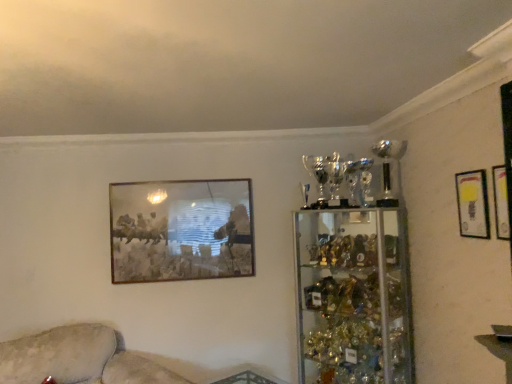
Question: Considering the relative positions of matte gold picture frame at upper right, which is the first picture frame from front to back, and clear glass trophy case at right in the image provided, is matte gold picture frame at upper right, which is the first picture frame from front to back, to the left or to the right of clear glass trophy case at right?

Choices:
 (A) left
 (B) right

Answer: (B)

Question: From their relative heights in the image, would you say matte gold picture frame at upper right, which is the first picture frame from front to back, is taller or shorter than clear glass trophy case at right?

Choices:
 (A) short
 (B) tall

Answer: (A)

Question: Estimate the real-world distances between objects in this image. Which object is closer to the matte gold picture frame at upper right, which appears as the second picture frame when viewed from the back?

Choices:
 (A) matte gold picture frame at upper right, placed as the 3th picture frame when sorted from back to front
 (B) clear glass trophy case at right
 (C) beige fabric couch at lower left
 (D) metallic gold picture frame at upper center, the 3th picture frame from the right

Answer: (A)

Question: Estimate the real-world distances between objects in this image. Which object is closer to the metallic gold picture frame at upper center, which is the 1th picture frame in back-to-front order?

Choices:
 (A) clear glass trophy case at right
 (B) beige fabric couch at lower left
 (C) matte gold picture frame at upper right, placed as the 3th picture frame when sorted from back to front
 (D) matte gold picture frame at upper right, marked as the 2th picture frame in a left-to-right arrangement

Answer: (B)